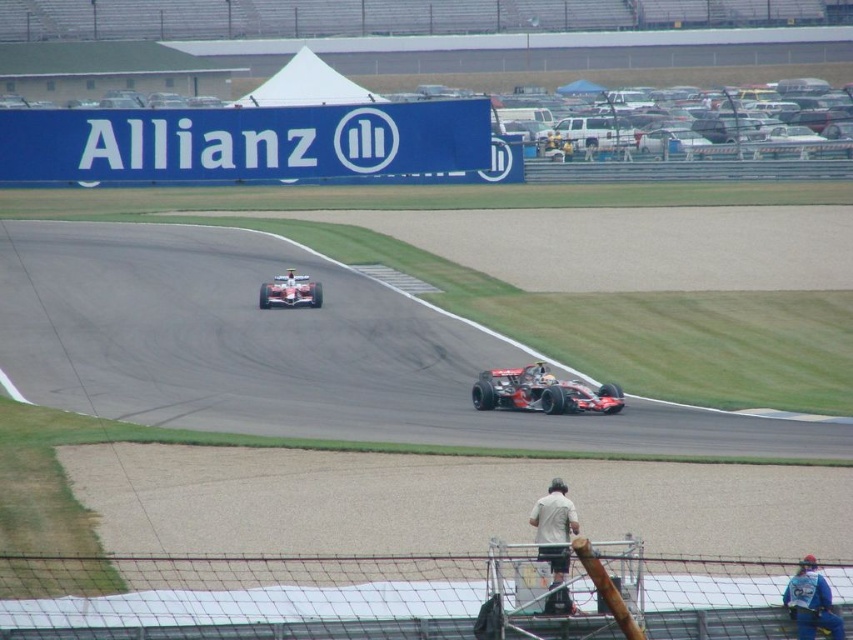
Question: Estimate the real-world distances between objects in this image. Which object is closer to the shiny silver helmet at center?

Choices:
 (A) white fabric person at center
 (B) blue denim jacket at lower right
 (C) shiny red race car at center

Answer: (C)

Question: In this image, where is shiny silver race car at center located relative to white fabric person at center?

Choices:
 (A) below
 (B) above

Answer: (A)

Question: Observing the image, what is the correct spatial positioning of shiny red race car at center in reference to shiny silver race car at center?

Choices:
 (A) below
 (B) above

Answer: (A)

Question: Is shiny red race car at center to the left of white fabric person at center from the viewer's perspective?

Choices:
 (A) yes
 (B) no

Answer: (A)

Question: Which point is farther to the camera?

Choices:
 (A) click(x=563, y=524)
 (B) click(x=578, y=403)

Answer: (B)

Question: Among these objects, which one is nearest to the camera?

Choices:
 (A) light gray fabric shirt at lower center
 (B) shiny red race car at center
 (C) shiny silver helmet at center

Answer: (A)